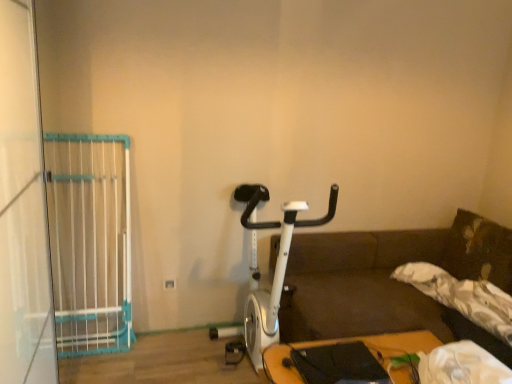
Question: Does wooden table at lower right lie behind white plastic gate at left?

Choices:
 (A) no
 (B) yes

Answer: (A)

Question: Is wooden table at lower right bigger than white plastic gate at left?

Choices:
 (A) no
 (B) yes

Answer: (B)

Question: Is wooden table at lower right wider than white plastic gate at left?

Choices:
 (A) no
 (B) yes

Answer: (B)

Question: From a real-world perspective, is wooden table at lower right beneath white plastic gate at left?

Choices:
 (A) no
 (B) yes

Answer: (B)

Question: Considering the relative sizes of wooden table at lower right and white plastic gate at left in the image provided, is wooden table at lower right thinner than white plastic gate at left?

Choices:
 (A) yes
 (B) no

Answer: (B)

Question: From their relative heights in the image, would you say wooden table at lower right is taller or shorter than white plastic gate at left?

Choices:
 (A) short
 (B) tall

Answer: (A)

Question: Looking at their shapes, would you say wooden table at lower right is wider or thinner than white plastic gate at left?

Choices:
 (A) thin
 (B) wide

Answer: (B)

Question: From the image's perspective, is wooden table at lower right positioned above or below white plastic gate at left?

Choices:
 (A) below
 (B) above

Answer: (A)

Question: Based on their sizes in the image, would you say wooden table at lower right is bigger or smaller than white plastic gate at left?

Choices:
 (A) small
 (B) big

Answer: (B)

Question: Which is correct: wooden table at lower right is inside white plastic gate at left, or outside of it?

Choices:
 (A) inside
 (B) outside

Answer: (B)

Question: Based on their sizes in the image, would you say wooden table at lower right is bigger or smaller than white plastic gate at left?

Choices:
 (A) big
 (B) small

Answer: (B)

Question: In terms of height, does wooden table at lower right look taller or shorter compared to white plastic gate at left?

Choices:
 (A) short
 (B) tall

Answer: (A)

Question: Considering the positions of point (410, 349) and point (2, 36), is point (410, 349) closer or farther from the camera than point (2, 36)?

Choices:
 (A) closer
 (B) farther

Answer: (B)

Question: Is point (74, 135) positioned closer to the camera than point (266, 319)?

Choices:
 (A) farther
 (B) closer

Answer: (A)

Question: Is white plastic gate at left bigger or smaller than white metallic stationary bicycle at center?

Choices:
 (A) big
 (B) small

Answer: (B)